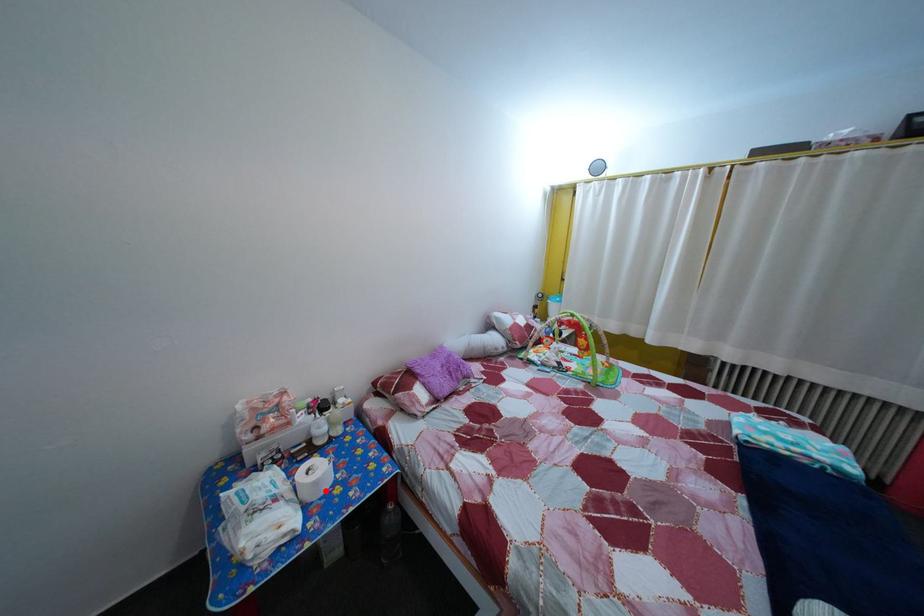
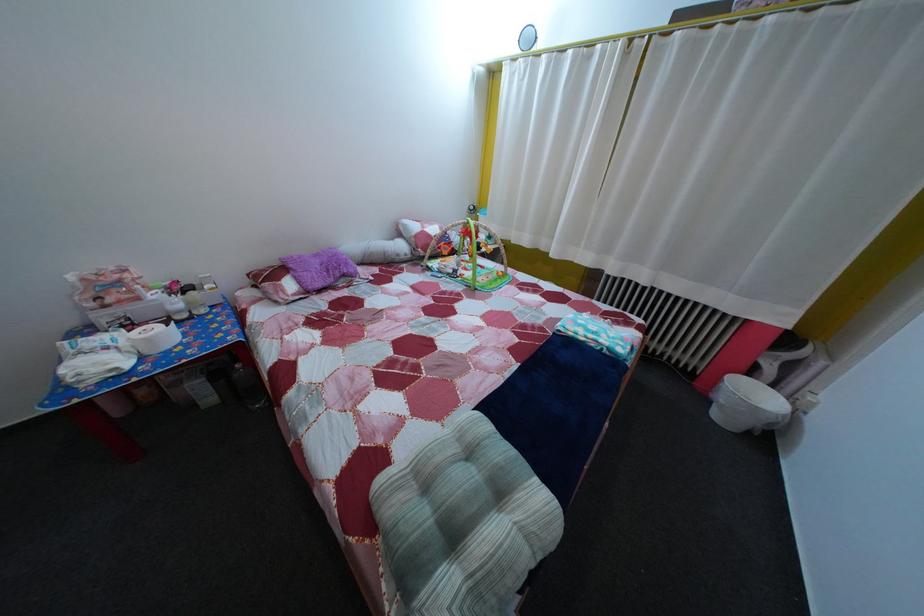
Question: A red point is marked in image1. In image2, is the corresponding 3D point closer to the camera or farther? Reply with the corresponding letter.

Choices:
 (A) The corresponding 3D point is closer.
 (B) The corresponding 3D point is farther.

Answer: (B)